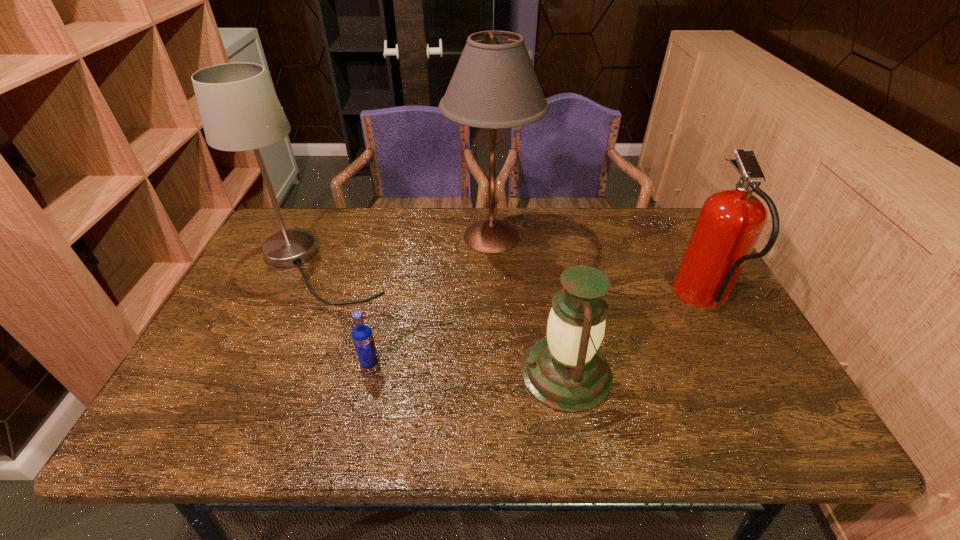
This screenshot has height=540, width=960. I want to click on object that is at the far left corner, so click(x=239, y=109).

You are a GUI agent. You are given a task and a screenshot of the screen. Output one action in this format:
    pyautogui.click(x=<x>, y=<y>)
    Task: Click on the vacant space at the far edge of the desktop
    This screenshot has height=540, width=960.
    Given the screenshot: What is the action you would take?
    pyautogui.click(x=337, y=215)

The width and height of the screenshot is (960, 540). Find the location of `free space at the near edge`. free space at the near edge is located at coordinates (314, 445).

The image size is (960, 540). I want to click on vacant region at the left edge of the desktop, so click(245, 345).

This screenshot has height=540, width=960. Identify the location of vacant space at the far left corner. (295, 227).

The height and width of the screenshot is (540, 960). Find the location of `vacant space at the near right corner of the desktop`. vacant space at the near right corner of the desktop is located at coordinates (784, 414).

The width and height of the screenshot is (960, 540). I want to click on free space between the fire extinguisher and the right table lamp, so click(598, 268).

This screenshot has width=960, height=540. I want to click on free space between the right table lamp and the shortest object, so click(431, 302).

Image resolution: width=960 pixels, height=540 pixels. Identify the location of vacant area between the fire extinguisher and the shortest object. (538, 334).

Where is `unoccupied position between the left table lamp and the lantern`? This screenshot has width=960, height=540. unoccupied position between the left table lamp and the lantern is located at coordinates (444, 320).